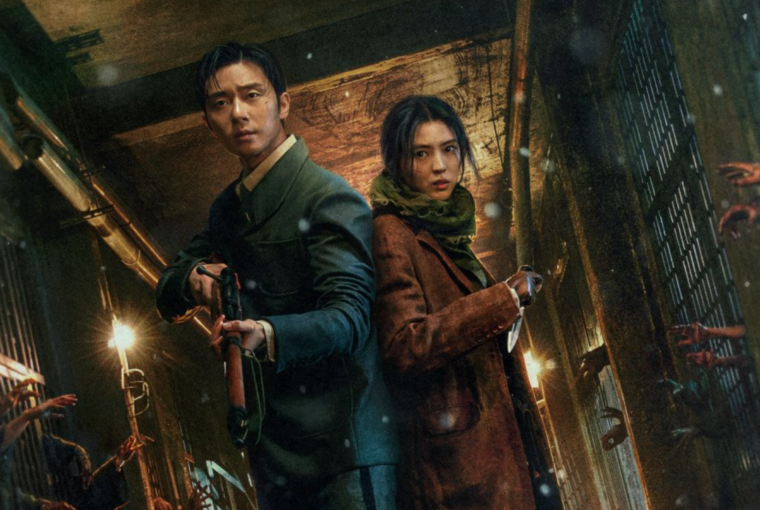
Image resolution: width=760 pixels, height=510 pixels. Identify the location of light sources. (128, 335), (530, 370).